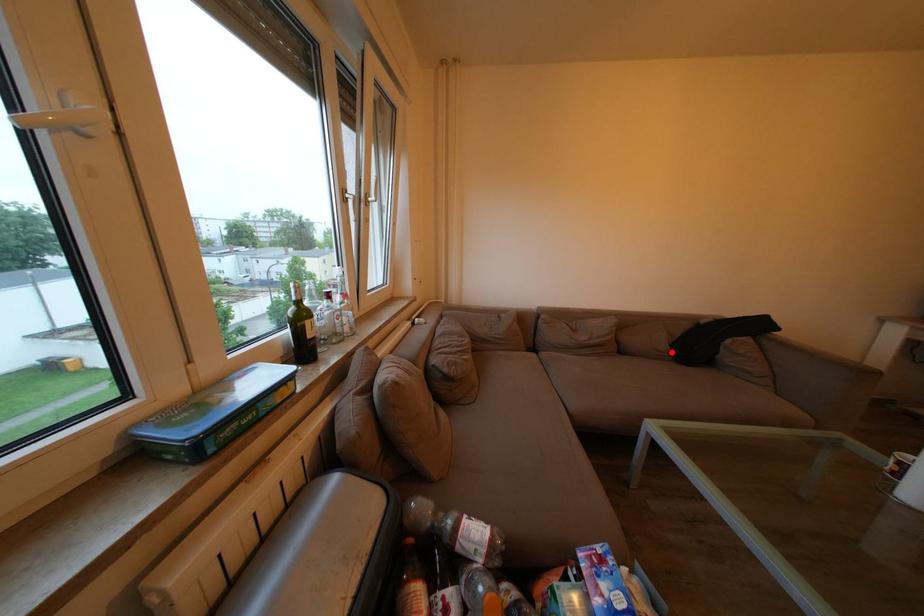
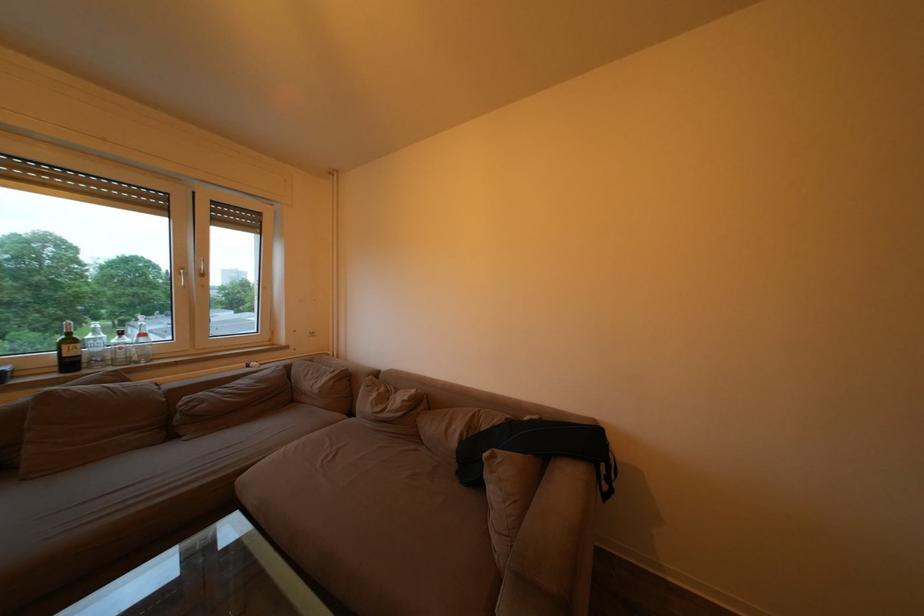
In the second image, find the point that corresponds to the highlighted location in the first image.

(463, 448)